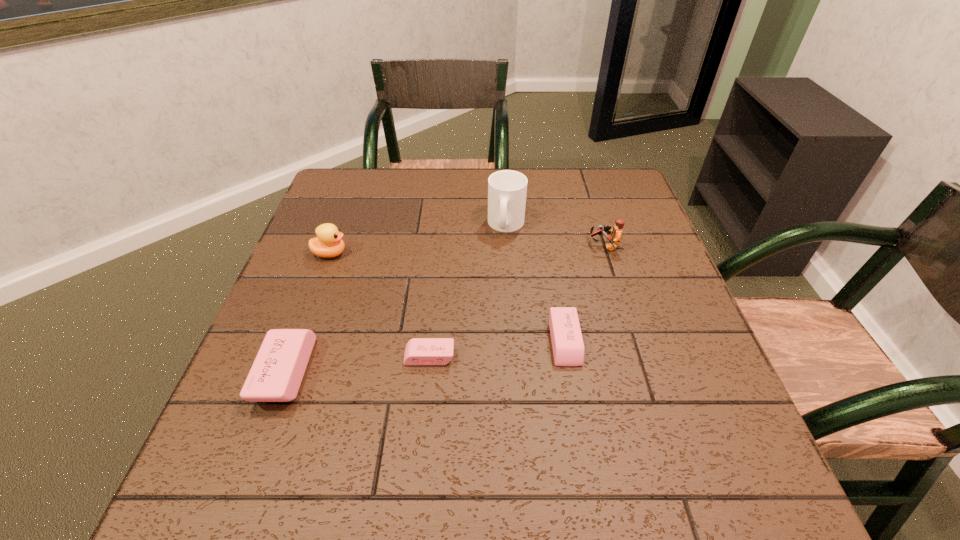
Where is `free space located 0.330m on the right of the leftmost eraser`? This screenshot has width=960, height=540. free space located 0.330m on the right of the leftmost eraser is located at coordinates (475, 372).

At what (x,y) coordinates should I click in order to perform the action: click on free space located 0.090m on the back of the second eraser from left to right. Please return your answer as a coordinate pair (x, y). Looking at the image, I should click on (434, 314).

Identify the location of vacant area situated 0.260m on the left of the rightmost eraser. (425, 342).

Where is `free region located on the handle side of the tallest object`? Image resolution: width=960 pixels, height=540 pixels. free region located on the handle side of the tallest object is located at coordinates (509, 255).

Identify the location of vacant point located 0.280m holding a crossbow in the hands of the Lego. The width and height of the screenshot is (960, 540). (480, 246).

Identify the location of free space located holding a crossbow in the hands of the Lego. (453, 246).

At what (x,y) coordinates should I click in order to perform the action: click on free space located holding a crossbow in the hands of the Lego. Please return your answer as a coordinate pair (x, y). The image size is (960, 540). Looking at the image, I should click on (492, 246).

Image resolution: width=960 pixels, height=540 pixels. Identify the location of vacant space located on the face of the duckling. (444, 253).

Locate an element on the screen. The image size is (960, 540). object that is at the far edge is located at coordinates (507, 189).

Find the location of a particular element. This screenshot has width=960, height=540. object present at the near edge is located at coordinates (277, 372).